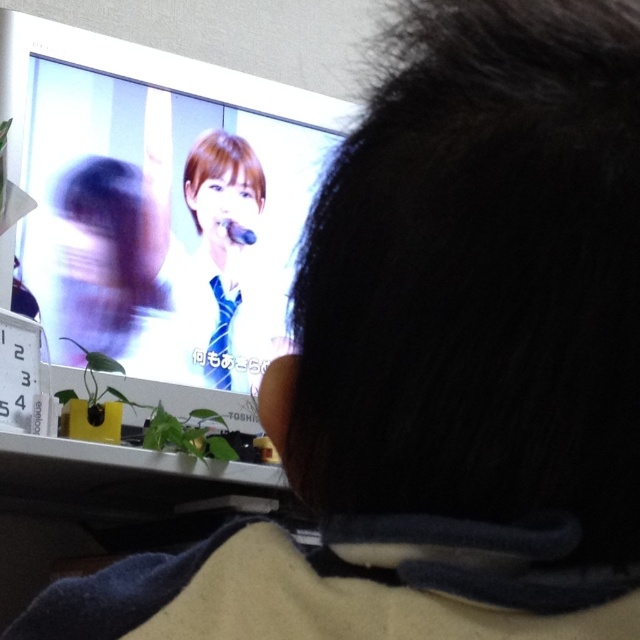
Is white glossy monitor at upper center smaller than blue silk tie at center?

Incorrect, white glossy monitor at upper center is not smaller in size than blue silk tie at center.

Is white glossy monitor at upper center taller than blue silk tie at center?

Indeed, white glossy monitor at upper center has a greater height compared to blue silk tie at center.

Between point (342, 125) and point (234, 294), which one is positioned in front?

Positioned in front is point (234, 294).

At what (x,y) coordinates should I click in order to perform the action: click on white glossy monitor at upper center. Please return your answer as a coordinate pair (x, y). Looking at the image, I should click on (157, 204).